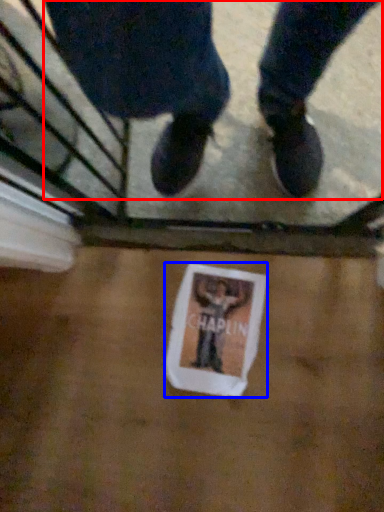
Question: Among these objects, which one is nearest to the camera, person (highlighted by a red box) or flyer (highlighted by a blue box)?

Choices:
 (A) person
 (B) flyer

Answer: (A)